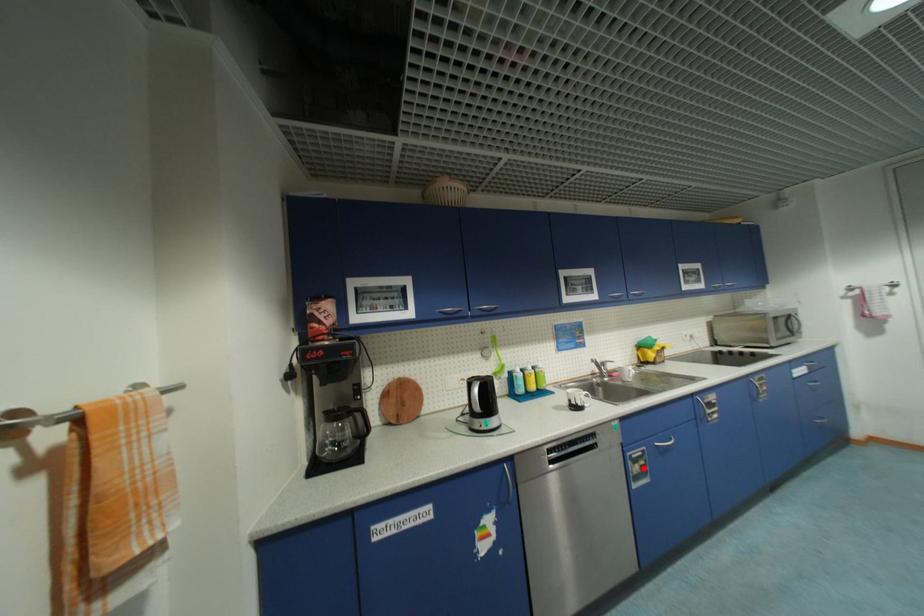
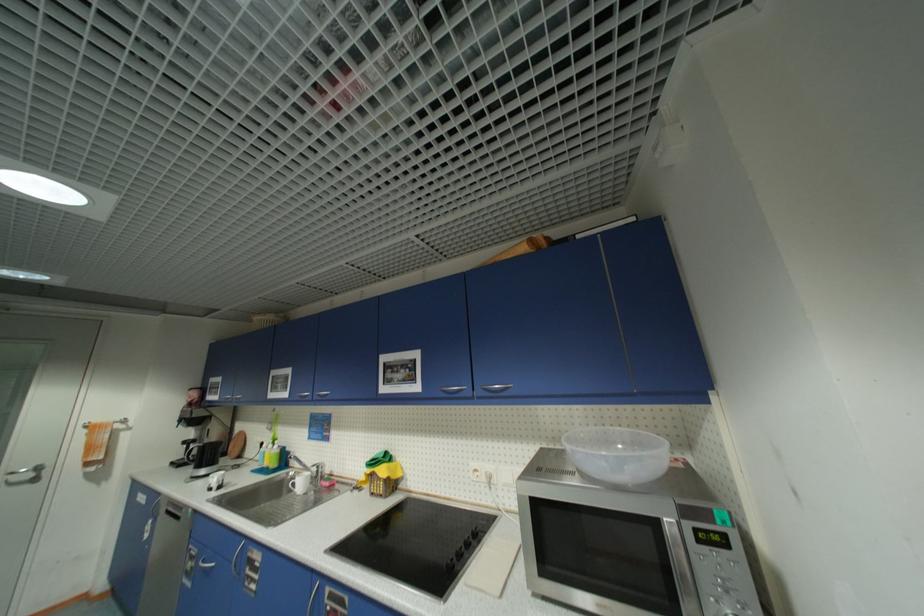
Question: I am providing you with two images of the same scene from different viewpoints. Given a red point in image1, look at the same physical point in image2. Is it:

Choices:
 (A) Closer to the viewpoint
 (B) Farther from the viewpoint

Answer: (A)